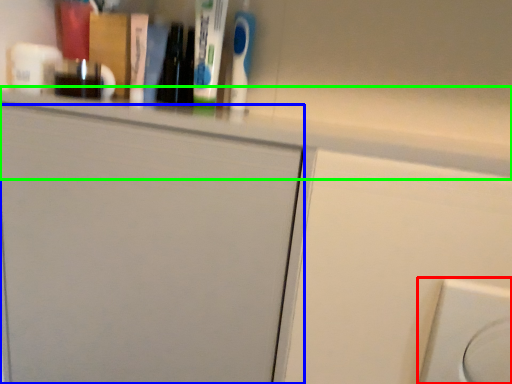
Question: Which object is positioned closest to electric outlet (highlighted by a red box)? Select from door (highlighted by a blue box) and ledge (highlighted by a green box).

Choices:
 (A) door
 (B) ledge

Answer: (B)